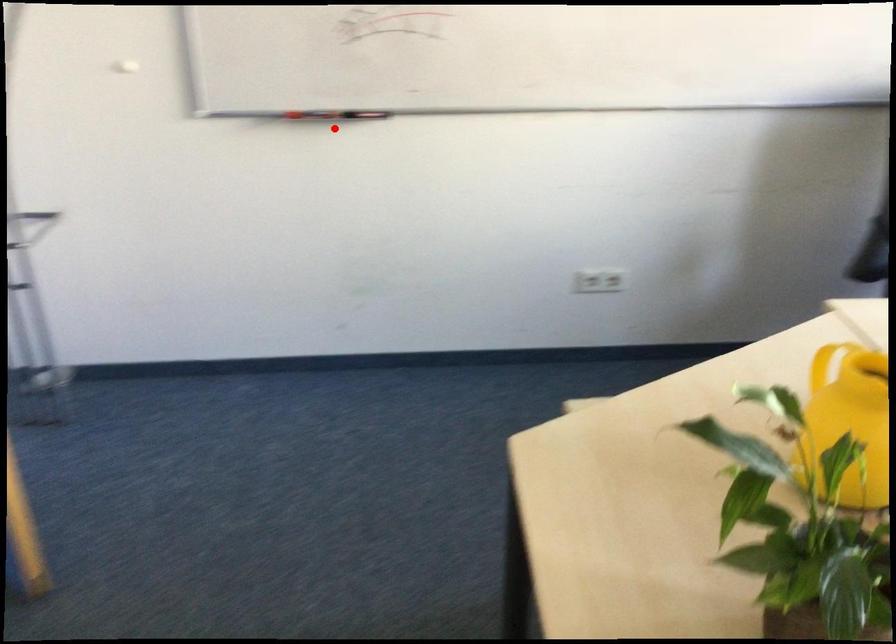
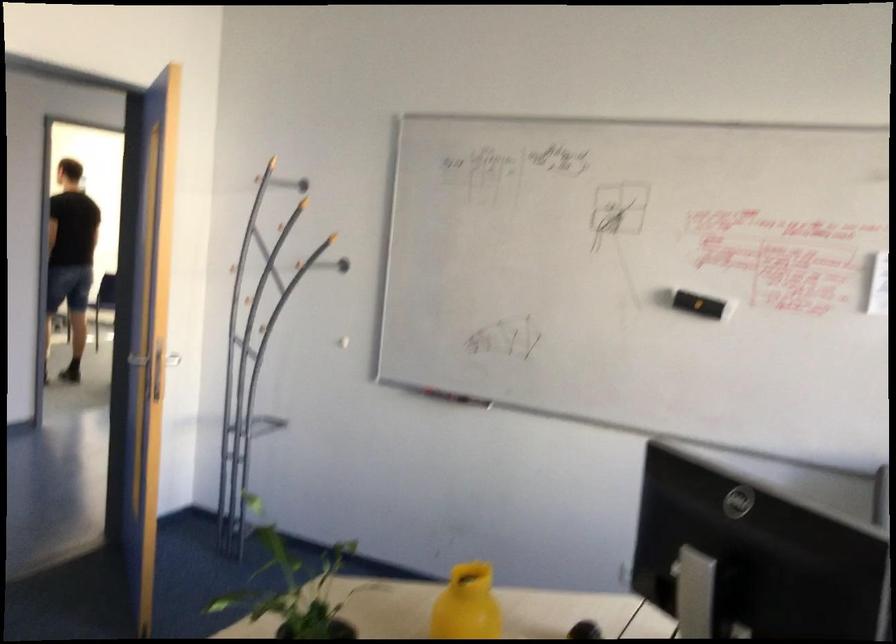
Question: I am providing you with two images of the same scene from different viewpoints. A red point is shown in image1. For the corresponding object point in image2, is it positioned nearer or farther from the camera?

Choices:
 (A) Nearer
 (B) Farther

Answer: (B)